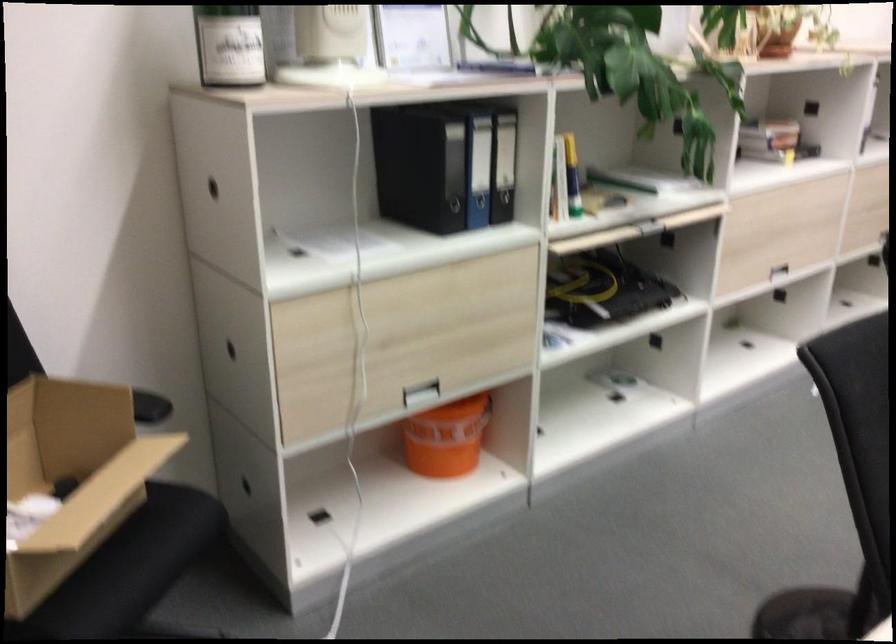
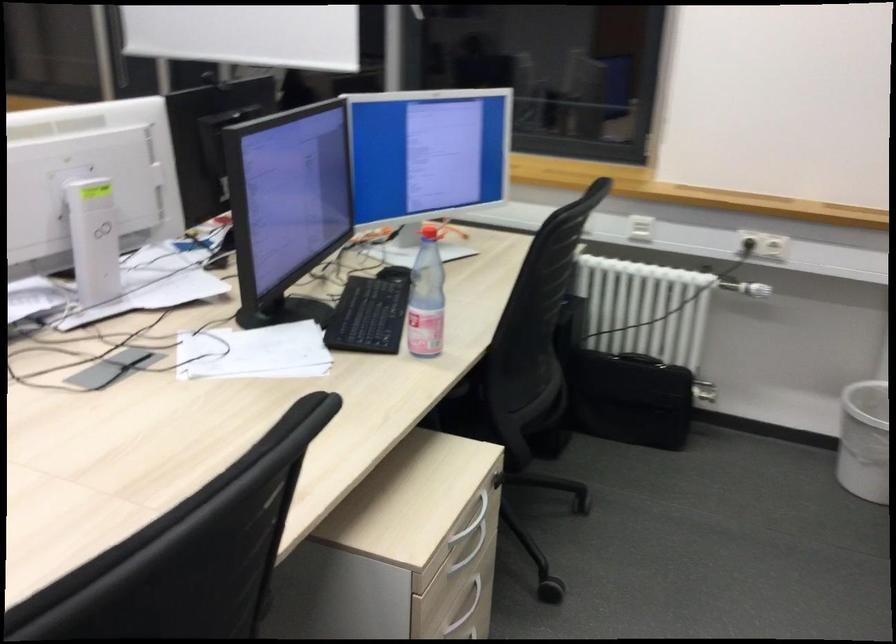
Question: What movement of the cameraman would produce the second image?

Choices:
 (A) Left
 (B) Right
 (C) Forward
 (D) Backward

Answer: (B)